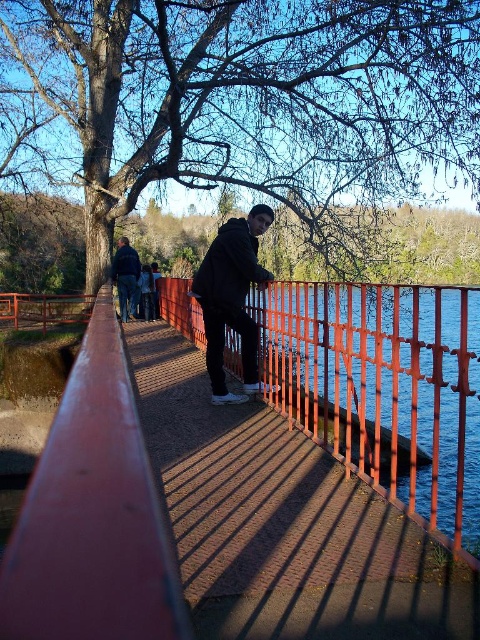
Based on the photo, is black matte jacket at center in front of dark blue jeans at left?

Yes, black matte jacket at center is closer to the viewer.

Measure the distance between black matte jacket at center and dark blue jeans at left.

black matte jacket at center is 9.06 meters away from dark blue jeans at left.

This screenshot has width=480, height=640. Find the location of `black matte jacket at center`. black matte jacket at center is located at coordinates (231, 298).

Which is behind, point (236, 493) or point (134, 260)?

Point (134, 260)

In order to click on brick pavement at center in this screenshot , I will do `click(283, 522)`.

Locate an element on the screen. The height and width of the screenshot is (640, 480). brick pavement at center is located at coordinates (283, 522).

Where is `brick pavement at center`? Image resolution: width=480 pixels, height=640 pixels. brick pavement at center is located at coordinates (283, 522).

Between brick pavement at center and black matte jacket at center, which one is positioned lower?

brick pavement at center is lower down.

Is point (382, 593) closer to viewer compared to point (255, 369)?

Yes.

The image size is (480, 640). In order to click on brick pavement at center in this screenshot , I will do `click(283, 522)`.